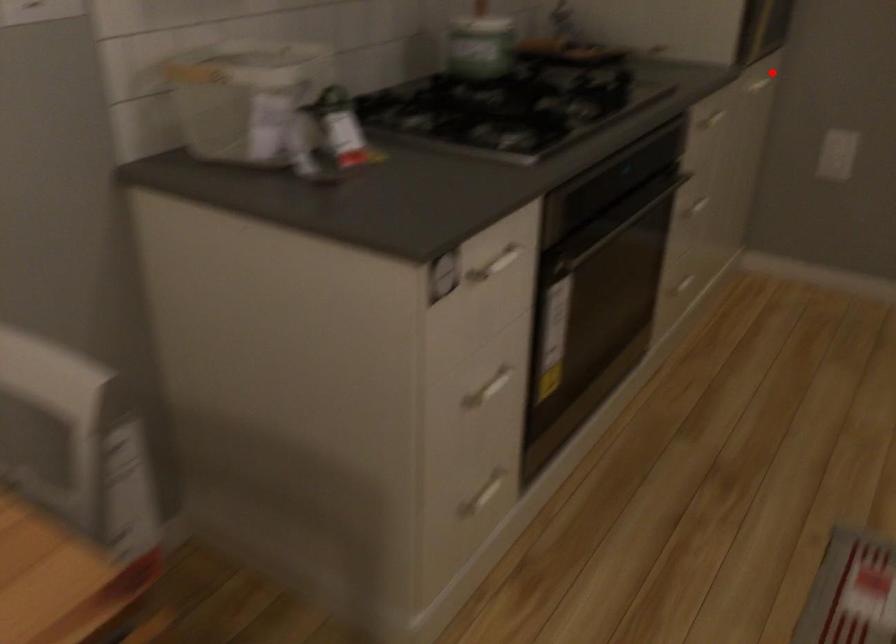
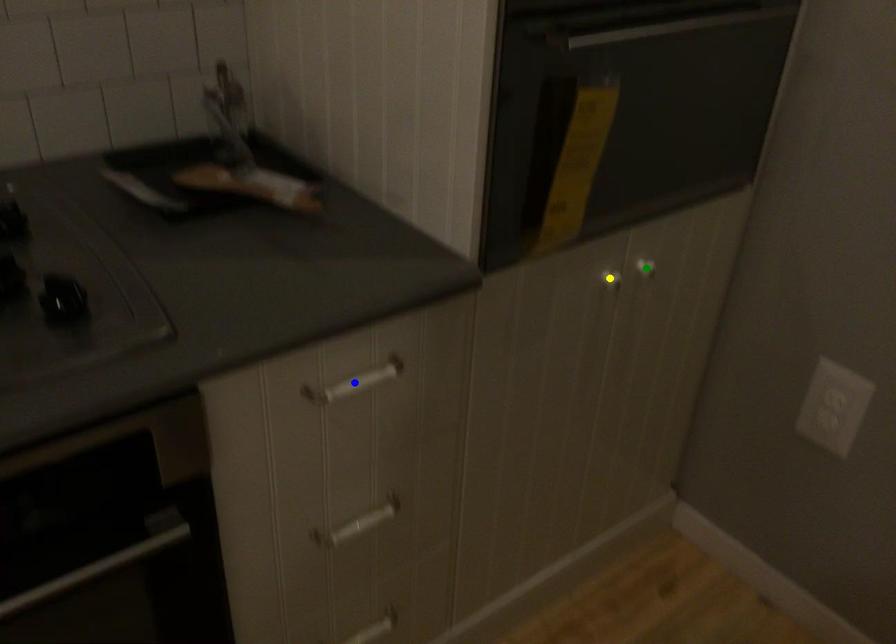
Question: I am providing you with two images of the same scene from different viewpoints. A red point is marked on the first image. You are given multiple points on the second image. Which spot in image 2 lines up with the point in image 1?

Choices:
 (A) yellow point
 (B) blue point
 (C) green point

Answer: (C)